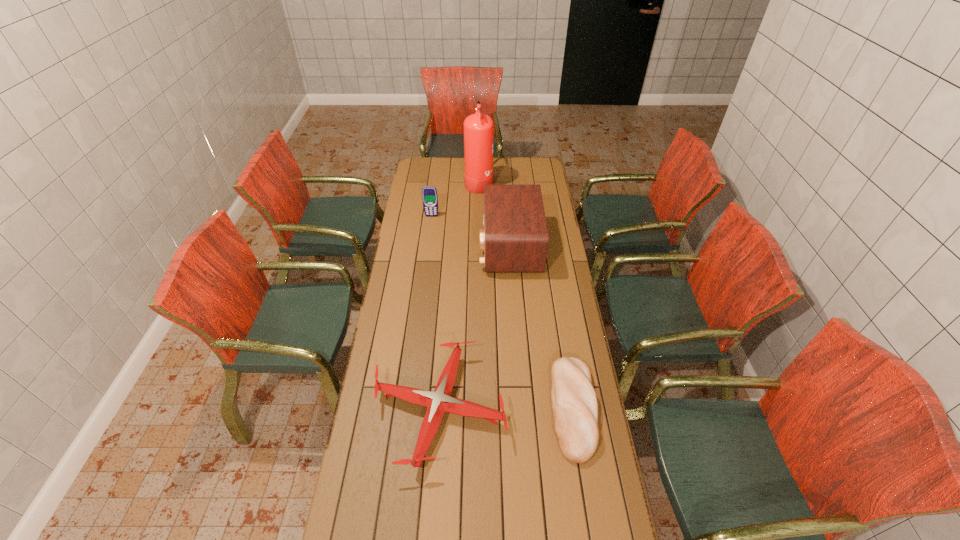
Find the location of a particular element. Image resolution: width=960 pixels, height=540 pixels. free spot that satisfies the following two spatial constraints: 1. towards the nozzle of the tallest object; 2. on the front-facing side of the cellular telephone is located at coordinates (479, 216).

Image resolution: width=960 pixels, height=540 pixels. Find the location of `free space that satisfies the following two spatial constraints: 1. on the front panel of the third farthest object; 2. on the right side of the bread`. free space that satisfies the following two spatial constraints: 1. on the front panel of the third farthest object; 2. on the right side of the bread is located at coordinates (521, 408).

Locate an element on the screen. This screenshot has height=540, width=960. vacant space that satisfies the following two spatial constraints: 1. on the front panel of the fourth shortest object; 2. on the right side of the bread is located at coordinates (521, 408).

The height and width of the screenshot is (540, 960). Find the location of `blank area in the image that satisfies the following two spatial constraints: 1. on the front panel of the bread; 2. on the left side of the second tallest object`. blank area in the image that satisfies the following two spatial constraints: 1. on the front panel of the bread; 2. on the left side of the second tallest object is located at coordinates (521, 408).